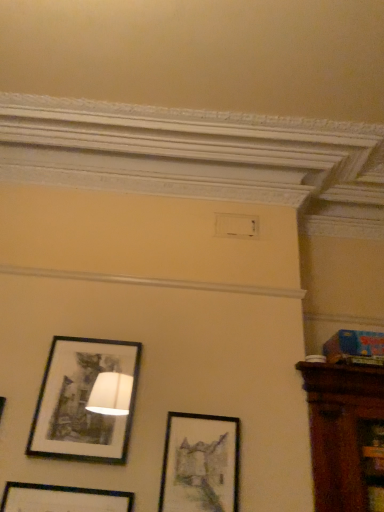
Question: Should I look upward or downward to see matte black picture frame at center, which ranks as the 1th picture frame in right-to-left order?

Choices:
 (A) down
 (B) up

Answer: (A)

Question: Does matte black picture frame at center, which ranks as the 1th picture frame in right-to-left order, have a smaller size compared to black matte picture frame at upper left, acting as the 1th picture frame starting from the left?

Choices:
 (A) yes
 (B) no

Answer: (A)

Question: Considering the relative sizes of matte black picture frame at center, which ranks as the 1th picture frame in right-to-left order, and black matte picture frame at upper left, acting as the 1th picture frame starting from the left, in the image provided, is matte black picture frame at center, which ranks as the 1th picture frame in right-to-left order, shorter than black matte picture frame at upper left, acting as the 1th picture frame starting from the left,?

Choices:
 (A) no
 (B) yes

Answer: (B)

Question: Does matte black picture frame at center, which ranks as the 1th picture frame in right-to-left order, turn towards black matte picture frame at upper left, acting as the 1th picture frame starting from the left?

Choices:
 (A) yes
 (B) no

Answer: (B)

Question: From a real-world perspective, is matte black picture frame at center, which ranks as the 1th picture frame in right-to-left order, physically above black matte picture frame at upper left, placed as the 2th picture frame when sorted from right to left?

Choices:
 (A) no
 (B) yes

Answer: (A)

Question: Is matte black picture frame at center, which is the 2th picture frame in left-to-right order, further to the viewer compared to black matte picture frame at upper left, acting as the 1th picture frame starting from the left?

Choices:
 (A) yes
 (B) no

Answer: (B)

Question: Can you confirm if matte black picture frame at center, which ranks as the 1th picture frame in right-to-left order, is positioned to the left of black matte picture frame at upper left, placed as the 2th picture frame when sorted from right to left?

Choices:
 (A) yes
 (B) no

Answer: (B)

Question: From a real-world perspective, is black matte picture frame at upper left, acting as the 1th picture frame starting from the left, on top of matte black picture frame at center, which ranks as the 1th picture frame in right-to-left order?

Choices:
 (A) no
 (B) yes

Answer: (B)

Question: Is black matte picture frame at upper left, acting as the 1th picture frame starting from the left, bigger than matte black picture frame at center, which is the 2th picture frame in left-to-right order?

Choices:
 (A) no
 (B) yes

Answer: (B)

Question: Can you confirm if black matte picture frame at upper left, acting as the 1th picture frame starting from the left, is wider than matte black picture frame at center, which ranks as the 1th picture frame in right-to-left order?

Choices:
 (A) yes
 (B) no

Answer: (A)

Question: Is the depth of black matte picture frame at upper left, placed as the 2th picture frame when sorted from right to left, less than that of matte black picture frame at center, which is the 2th picture frame in left-to-right order?

Choices:
 (A) yes
 (B) no

Answer: (B)

Question: From the image's perspective, is black matte picture frame at upper left, acting as the 1th picture frame starting from the left, under matte black picture frame at center, which is the 2th picture frame in left-to-right order?

Choices:
 (A) yes
 (B) no

Answer: (B)

Question: Are black matte picture frame at upper left, acting as the 1th picture frame starting from the left, and matte black picture frame at center, which is the 2th picture frame in left-to-right order, beside each other?

Choices:
 (A) no
 (B) yes

Answer: (A)

Question: From a real-world perspective, is matte black picture frame at center, which is the 2th picture frame in left-to-right order, physically located above or below black matte picture frame at upper left, acting as the 1th picture frame starting from the left?

Choices:
 (A) below
 (B) above

Answer: (A)